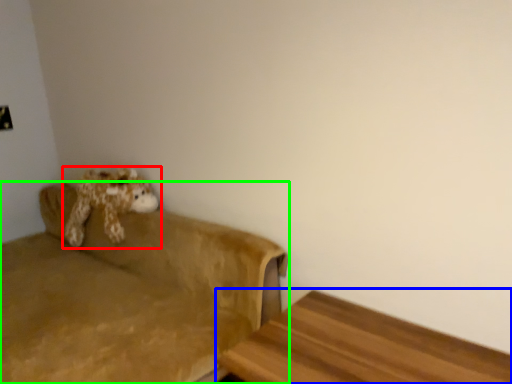
Question: Which object is the farthest from toy (highlighted by a red box)? Choose among these: furniture (highlighted by a blue box) or studio couch (highlighted by a green box).

Choices:
 (A) furniture
 (B) studio couch

Answer: (A)